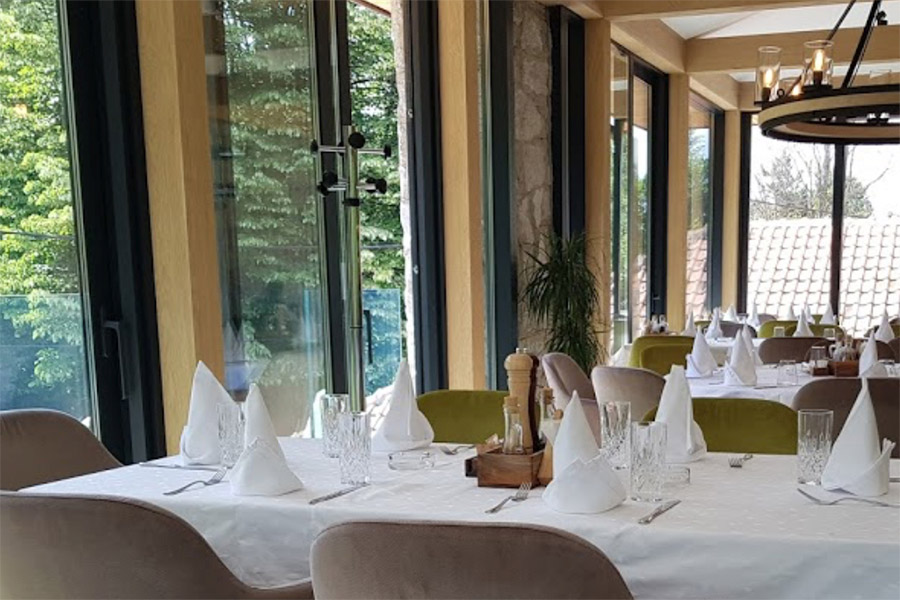
Locate an element on the screen. This screenshot has height=600, width=900. wooden beams is located at coordinates (183, 216), (459, 183), (601, 173), (676, 188), (729, 196), (631, 10), (724, 52), (749, 98).